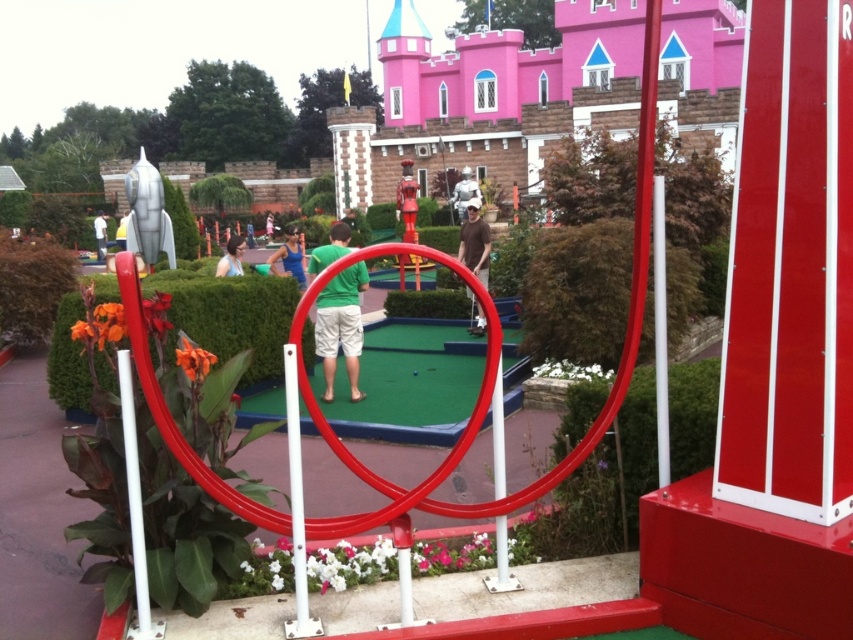
You are a miniature golfer trying to line up your shot. You notice the white plastic pole at lower left and the brown matte shirt at center. Which object has a smaller width when viewed from your perspective?

The white plastic pole at lower left is thinner than the brown matte shirt at center, so the white plastic pole at lower left has a smaller width.

You are trying to decide whether to place a new decorative flag on the white plastic pole at center or the green fabric shirt at center. Which object can the flag be attached to?

The flag can be attached to the white plastic pole at center because it is a pole, while the green fabric shirt at center is clothing and not suitable for attaching a flag.

You are a golfer standing at the tee, aiming to hit the ball towards the hole. There is a white plastic pole at center and a green fabric shirt at center in your way. Which object is shorter and might not obstruct your shot?

The white plastic pole at center is shorter than the green fabric shirt at center, so it might not obstruct your shot as much as the taller object.